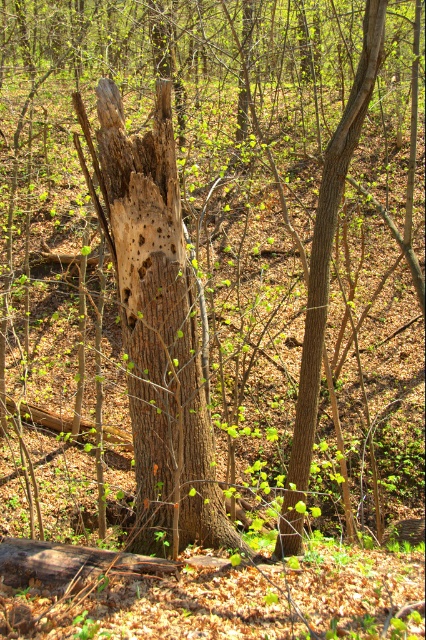
Who is lower down, brown rough bark tree trunk at center or smooth brown tree trunk at center?

brown rough bark tree trunk at center is lower down.

Is brown rough bark tree trunk at center below smooth brown tree trunk at center?

Yes.

Is point (150, 310) closer to viewer compared to point (310, 396)?

No, it is behind (310, 396).

This screenshot has height=640, width=426. Find the location of `brown rough bark tree trunk at center`. brown rough bark tree trunk at center is located at coordinates (158, 330).